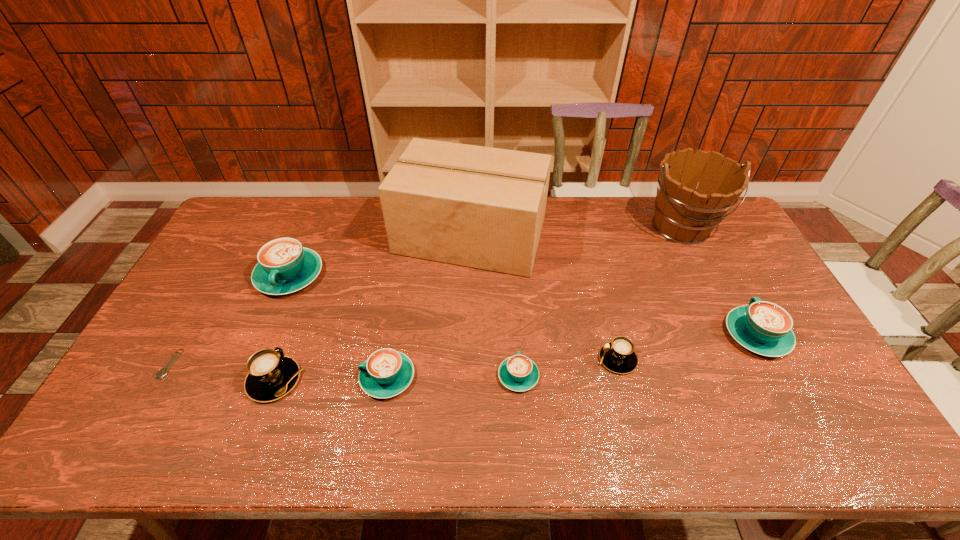
Image resolution: width=960 pixels, height=540 pixels. Find the location of `free space at the far left corner of the desktop`. free space at the far left corner of the desktop is located at coordinates (271, 214).

This screenshot has width=960, height=540. Identify the location of vacant point at the near right corner. (860, 457).

Identify the location of free space between the wine bucket and the rightmost turquoise cappuccino. The height and width of the screenshot is (540, 960). (718, 281).

Where is `free area in between the box and the second biggest turquoise cappuccino`? Image resolution: width=960 pixels, height=540 pixels. free area in between the box and the second biggest turquoise cappuccino is located at coordinates (613, 286).

The width and height of the screenshot is (960, 540). Identify the location of vacant region between the wine bucket and the eighth tallest object. (599, 301).

Locate an element on the screen. This screenshot has height=540, width=960. vacant point located between the wine bucket and the rightmost turquoise cappuccino is located at coordinates (718, 281).

Locate an element on the screen. The image size is (960, 540). vacant region between the rightmost cappuccino and the farthest cappuccino is located at coordinates (523, 305).

Locate an element on the screen. This screenshot has height=540, width=960. free space between the shortest object and the wine bucket is located at coordinates (425, 295).

Find the location of a particular element. free spot between the bigger black cappuccino and the tallest cappuccino is located at coordinates (282, 328).

Image resolution: width=960 pixels, height=540 pixels. What are the coordinates of `free space between the fourth cappuccino from left to right and the second smallest turquoise cappuccino` in the screenshot? It's located at pos(453,376).